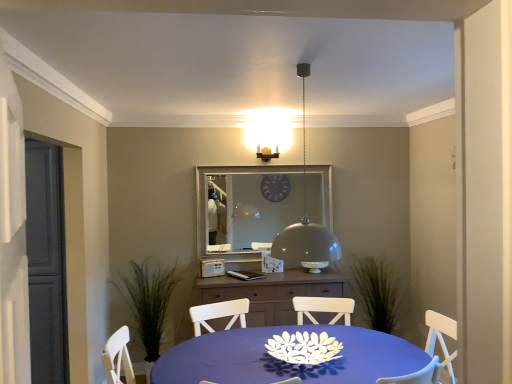
Question: Relative to matte gray glass door at left, is green leafy plant at left in front or behind?

Choices:
 (A) behind
 (B) front

Answer: (A)

Question: Considering the positions of green leafy plant at left and matte gray glass door at left in the image, is green leafy plant at left wider or thinner than matte gray glass door at left?

Choices:
 (A) thin
 (B) wide

Answer: (A)

Question: Based on their relative distances, which object is farther from the white paper flower at center?

Choices:
 (A) silver metallic mirror at center
 (B) matte gray glass door at left
 (C) green leafy plant at left
 (D) matte brown pendant light at upper center
 (E) matte brown cabinet at center

Answer: (D)

Question: Which object is positioned farthest from the matte gray glass door at left?

Choices:
 (A) green leafy plant at left
 (B) blue fabric table at center
 (C) matte brown pendant light at upper center
 (D) matte gray dome at center
 (E) silver metallic mirror at center

Answer: (C)